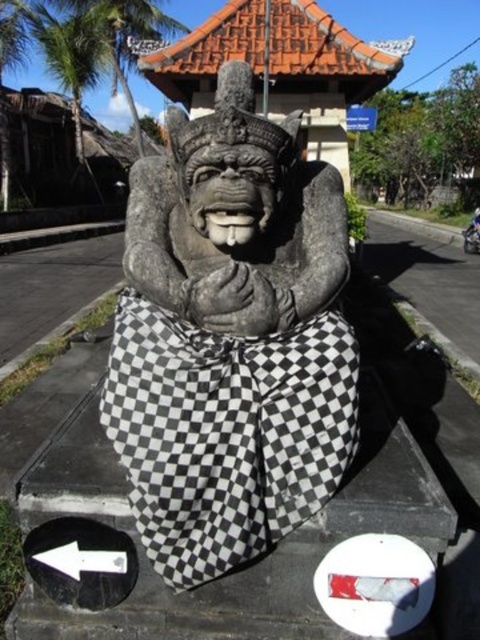
You are a visitor at a cultural park and see the stone statue at center and the metallic silver motorcycle at center. Which object is taller?

The metallic silver motorcycle at center is taller than the stone statue at center.

You are a visitor at a cultural site and see the stone statue at center and the metallic silver motorcycle at center. Which object is positioned to the left from your perspective?

The stone statue at center is positioned to the left of the metallic silver motorcycle at center.